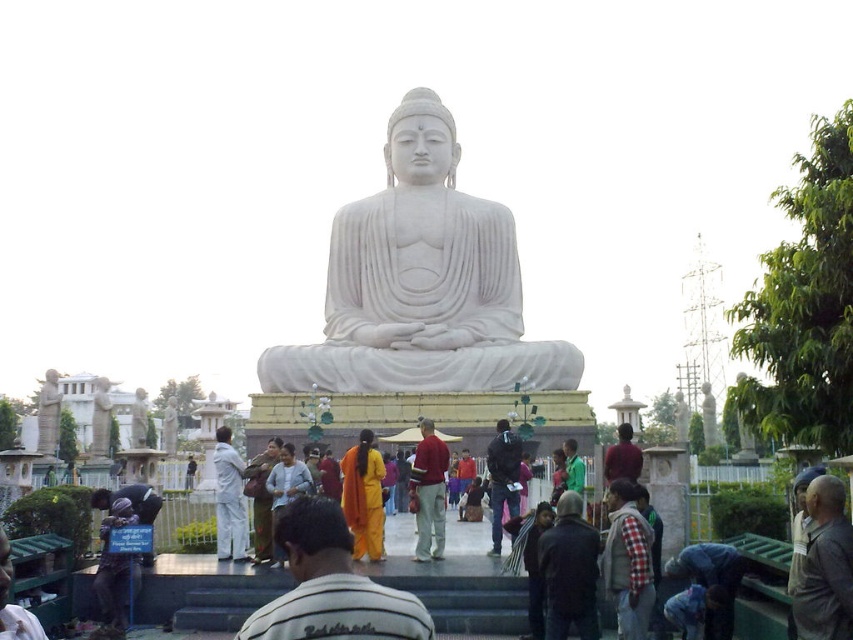
Where is `yellow clothed monk at center`? This screenshot has width=853, height=640. yellow clothed monk at center is located at coordinates (331, 586).

Is point (352, 636) closer to viewer compared to point (827, 524)?

Yes, it is.

The image size is (853, 640). What are the coordinates of `yellow clothed monk at center` in the screenshot? It's located at (331, 586).

This screenshot has height=640, width=853. What are the coordinates of `white marble statue at center` in the screenshot? It's located at (421, 284).

Can you confirm if white marble statue at center is bigger than yellow clothed monk at center?

Yes.

Does point (473, 250) come farther from viewer compared to point (326, 636)?

Yes.

Image resolution: width=853 pixels, height=640 pixels. What are the coordinates of `white marble statue at center` in the screenshot? It's located at click(421, 284).

Which is below, white marble statue at center or brown textured cloth at lower right?

Positioned lower is brown textured cloth at lower right.

Is point (425, 228) positioned after point (813, 531)?

Yes.

Does point (386, 145) come closer to viewer compared to point (814, 589)?

No, (386, 145) is behind (814, 589).

Where is `white marble statue at center`? white marble statue at center is located at coordinates (421, 284).